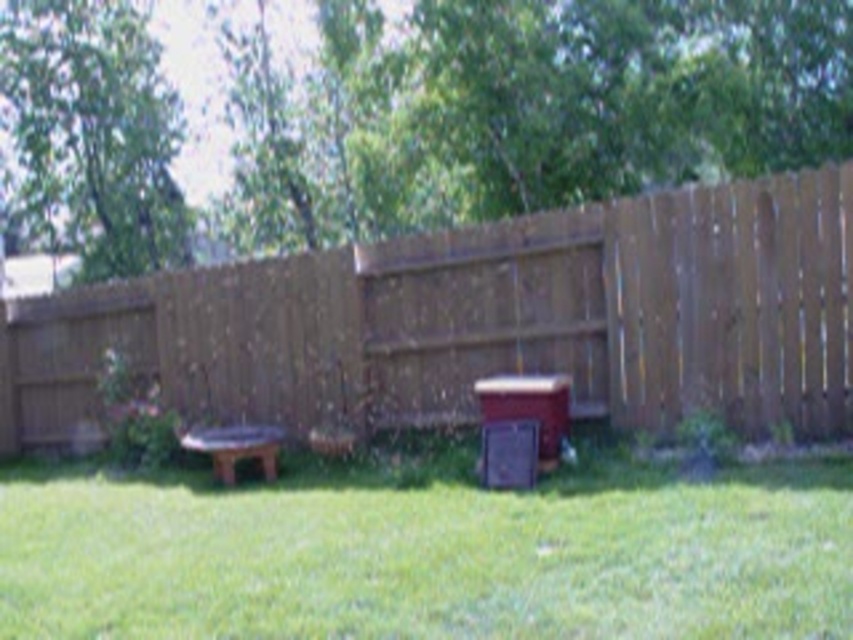
Does brown wooden fence at center appear on the left side of green grass at lower center?

Indeed, brown wooden fence at center is positioned on the left side of green grass at lower center.

Find the location of a particular element. The width and height of the screenshot is (853, 640). brown wooden fence at center is located at coordinates (479, 321).

Identify the location of brown wooden fence at center. (479, 321).

Does brown wooden fence at center lie behind brown wooden picnic table at center?

No, brown wooden fence at center is in front of brown wooden picnic table at center.

Identify the location of brown wooden fence at center. (479, 321).

At what (x,y) coordinates should I click in order to perform the action: click on brown wooden fence at center. Please return your answer as a coordinate pair (x, y). Looking at the image, I should click on (479, 321).

Who is positioned more to the left, green grass at lower center or brown wooden picnic table at center?

brown wooden picnic table at center

Is green grass at lower center thinner than brown wooden picnic table at center?

Yes.

Is point (347, 525) in front of point (248, 449)?

Yes, it is in front of point (248, 449).

You are a GUI agent. You are given a task and a screenshot of the screen. Output one action in this format:
    pyautogui.click(x=<x>, y=<y>)
    Task: Click on the green grass at lower center
    The width and height of the screenshot is (853, 640).
    Given the screenshot: What is the action you would take?
    pyautogui.click(x=426, y=552)